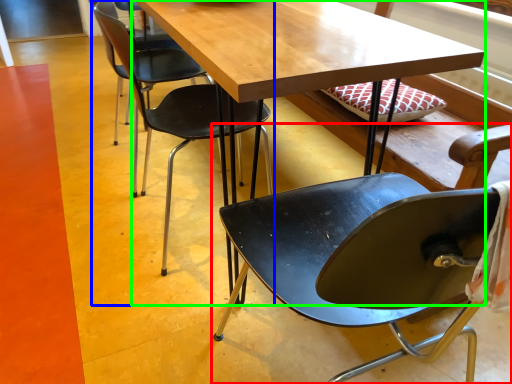
Question: Based on their relative distances, which object is nearer to chair (highlighted by a red box)? Choose from chair (highlighted by a blue box) and table (highlighted by a green box).

Choices:
 (A) chair
 (B) table

Answer: (B)